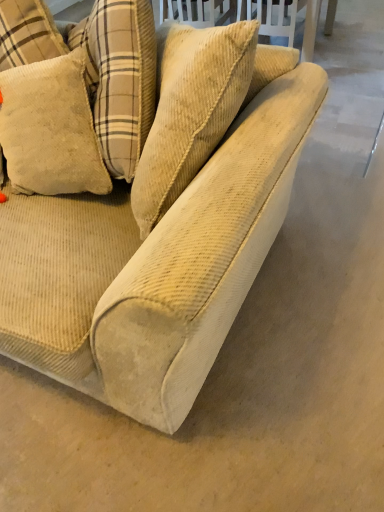
Question: Is beige corduroy pillow at upper left to the left or to the right of beige corduroy couch at center in the image?

Choices:
 (A) right
 (B) left

Answer: (B)

Question: From the image's perspective, is beige corduroy pillow at upper left positioned above or below beige corduroy couch at center?

Choices:
 (A) below
 (B) above

Answer: (B)

Question: From a real-world perspective, is beige corduroy pillow at upper left above or below beige corduroy couch at center?

Choices:
 (A) above
 (B) below

Answer: (A)

Question: From the image's perspective, is beige corduroy couch at center above or below beige corduroy pillow at upper left?

Choices:
 (A) above
 (B) below

Answer: (B)

Question: Is beige corduroy couch at center situated inside beige corduroy pillow at upper left or outside?

Choices:
 (A) outside
 (B) inside

Answer: (A)

Question: Relative to beige corduroy pillow at upper left, is beige corduroy couch at center in front or behind?

Choices:
 (A) behind
 (B) front

Answer: (B)

Question: Is beige corduroy couch at center bigger or smaller than beige corduroy pillow at upper left?

Choices:
 (A) small
 (B) big

Answer: (B)